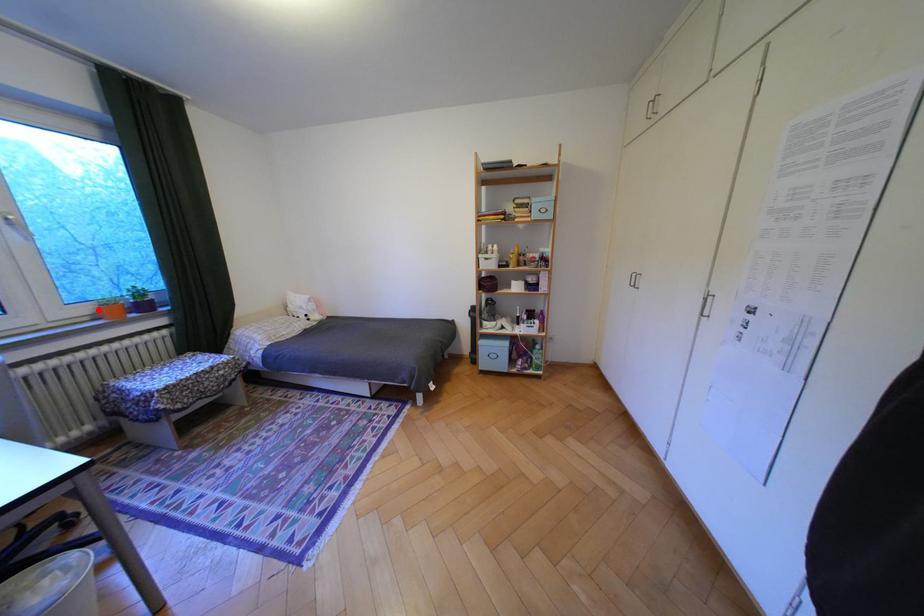
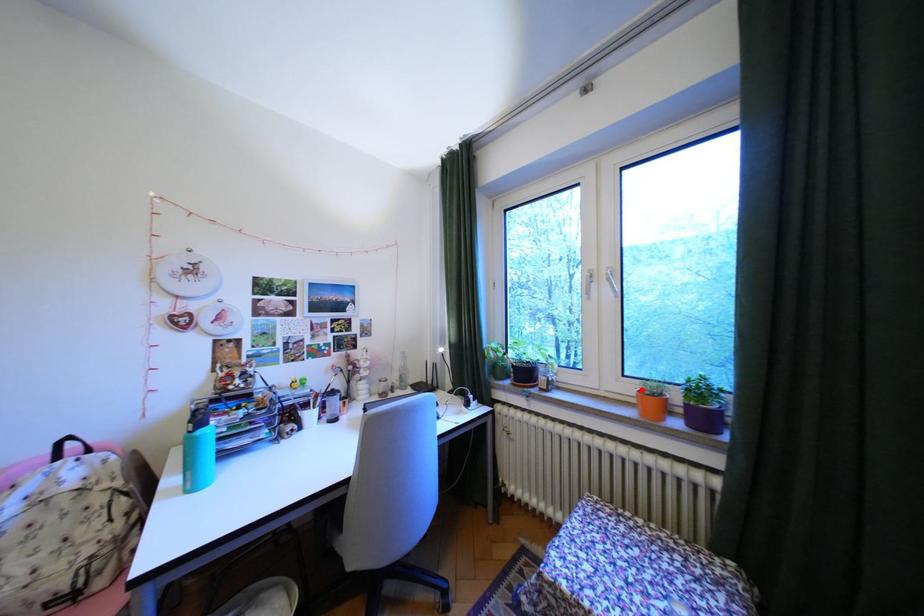
I am providing you with two images of the same scene from different viewpoints. A red point is marked on the first image and another point is marked on the second image. Do the highlighted points in image1 and image2 indicate the same real-world spot?

Yes